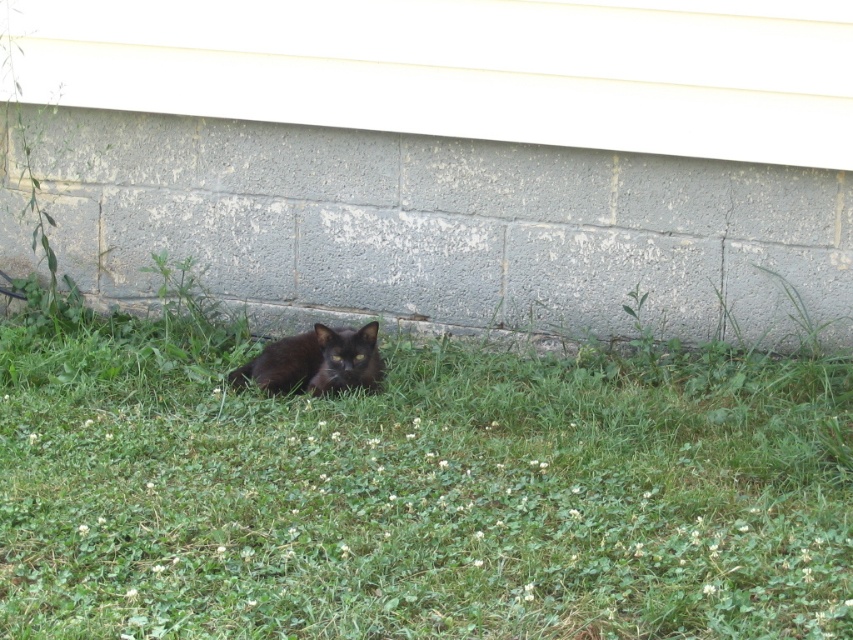
Who is shorter, green grass at lower center or shiny black cat at lower center?

With less height is shiny black cat at lower center.

The height and width of the screenshot is (640, 853). I want to click on green grass at lower center, so click(x=415, y=488).